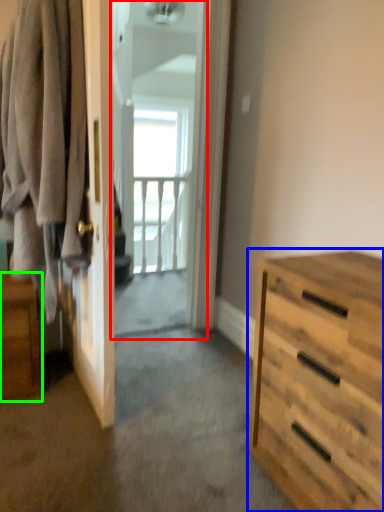
Question: Based on their relative distances, which object is farther from screen door (highlighted by a red box)? Choose from chest of drawers (highlighted by a blue box) and nightstand (highlighted by a green box).

Choices:
 (A) chest of drawers
 (B) nightstand

Answer: (A)